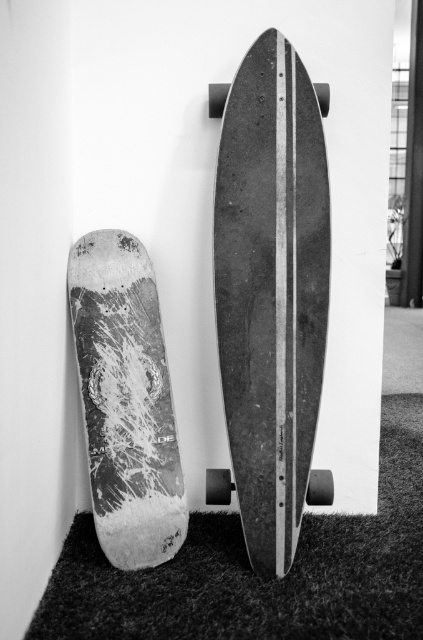
Question: Can you confirm if smooth wood skateboard at center is bigger than speckled wood skateboard at left?

Choices:
 (A) yes
 (B) no

Answer: (B)

Question: Is the position of smooth wood skateboard at center less distant than that of textured carpet at lower center?

Choices:
 (A) no
 (B) yes

Answer: (A)

Question: Which object is farther from the camera taking this photo?

Choices:
 (A) smooth wood skateboard at center
 (B) speckled wood skateboard at left
 (C) textured carpet at lower center

Answer: (B)

Question: Which object is positioned closest to the textured carpet at lower center?

Choices:
 (A) smooth wood skateboard at center
 (B) speckled wood skateboard at left

Answer: (B)

Question: Which point is farther from the camera taking this photo?

Choices:
 (A) (367, 547)
 (B) (137, 426)

Answer: (A)

Question: Is smooth wood skateboard at center further to the viewer compared to speckled wood skateboard at left?

Choices:
 (A) yes
 (B) no

Answer: (B)